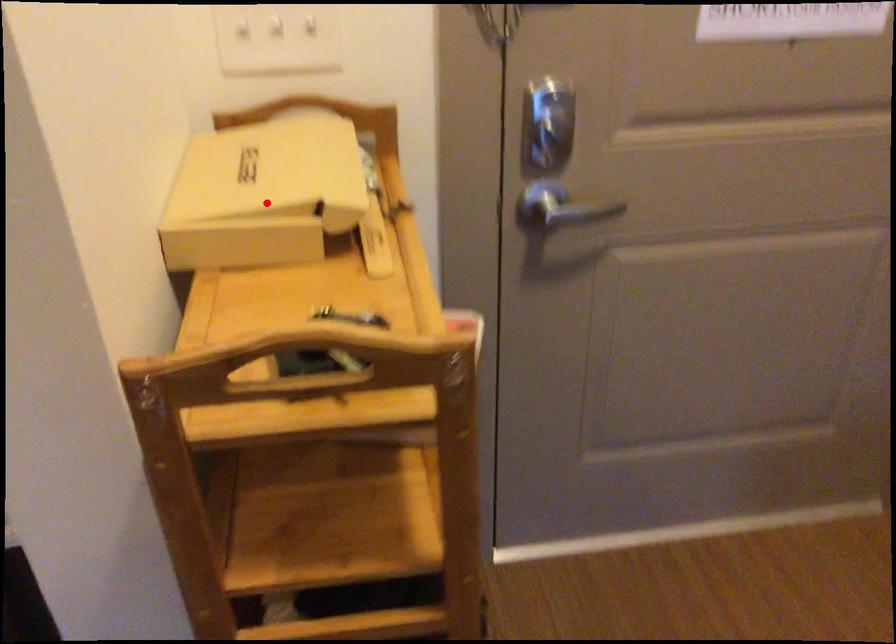
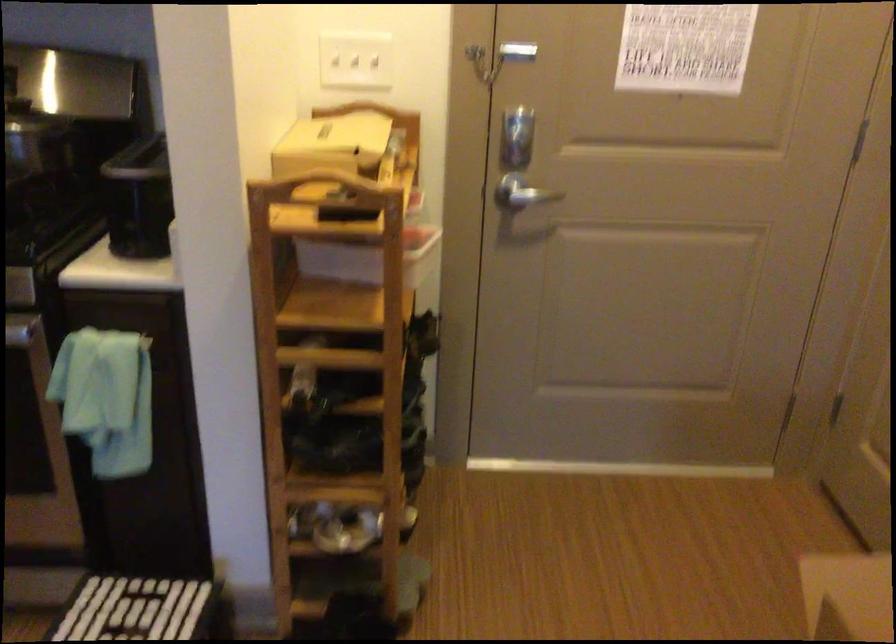
Question: I am providing you with two images of the same scene from different viewpoints. In image1, a red point is highlighted. Considering the same 3D point in image2, which of the following is correct?

Choices:
 (A) It is closer
 (B) It is farther

Answer: (B)